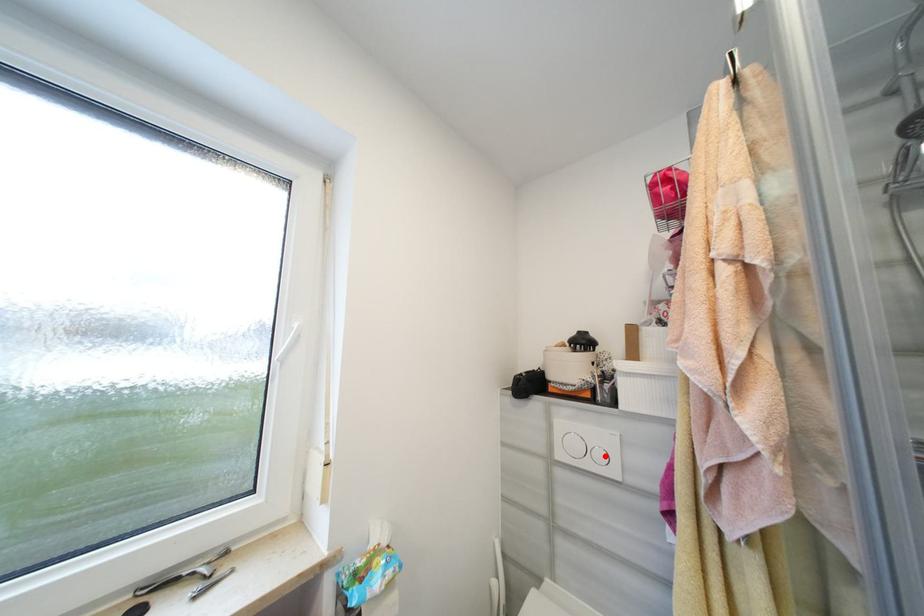
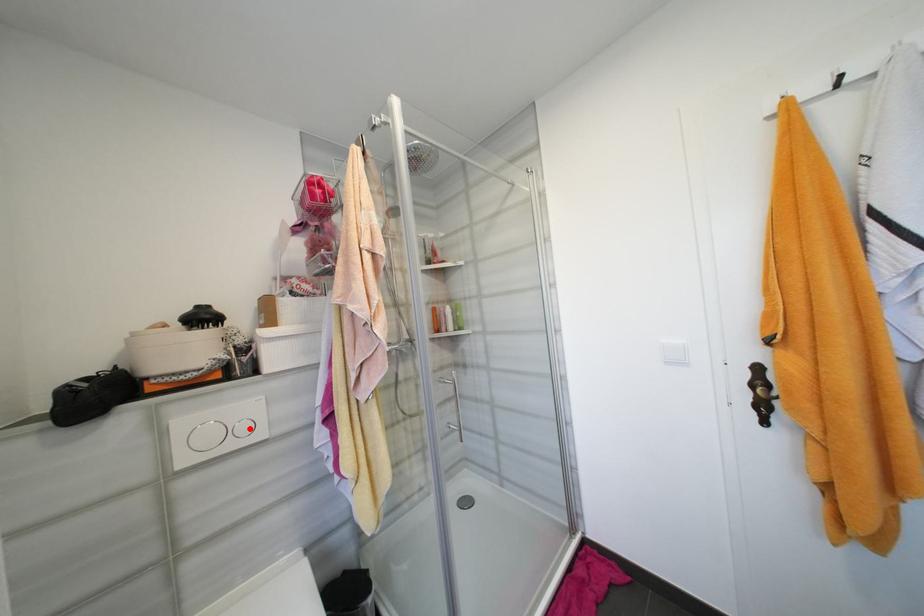
I am providing you with two images of the same scene from different viewpoints. A red point is marked on the first image and another point is marked on the second image. Does the point marked in image1 correspond to the same location as the one in image2?

Yes